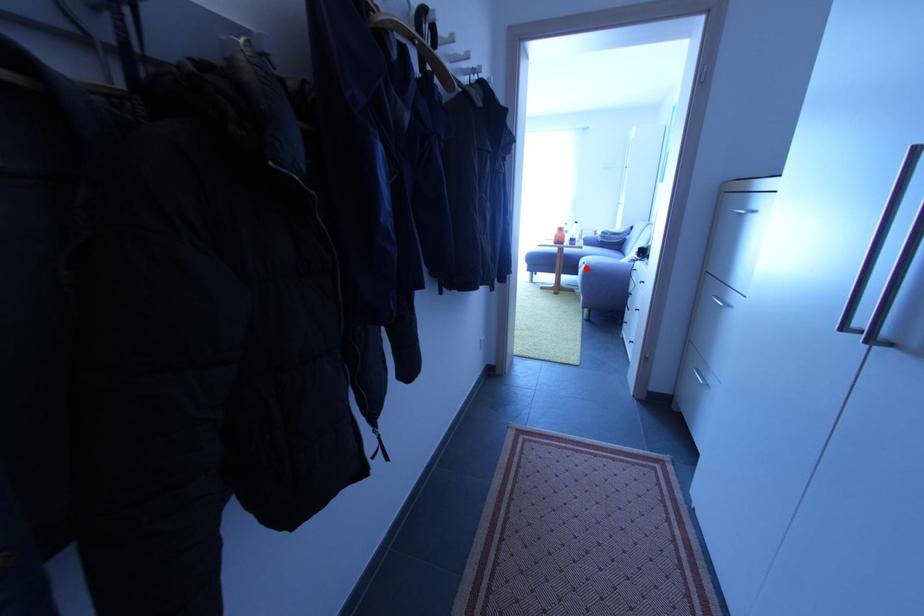
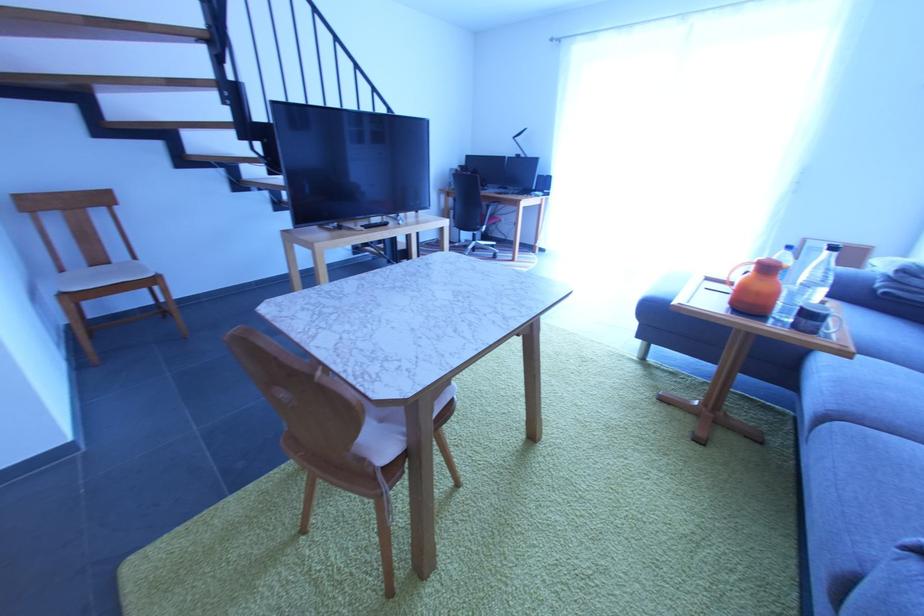
Question: I am providing you with two images of the same scene from different viewpoints. Image1 has a red point marked. In image2, the corresponding 3D location appears at what relative position? Reply with the corresponding letter.

Choices:
 (A) Closer
 (B) Farther

Answer: (B)